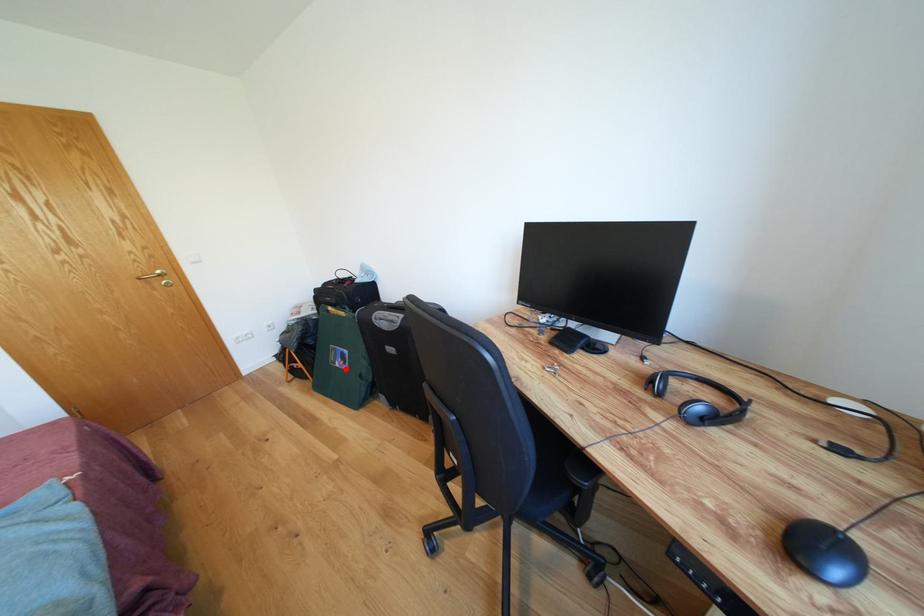
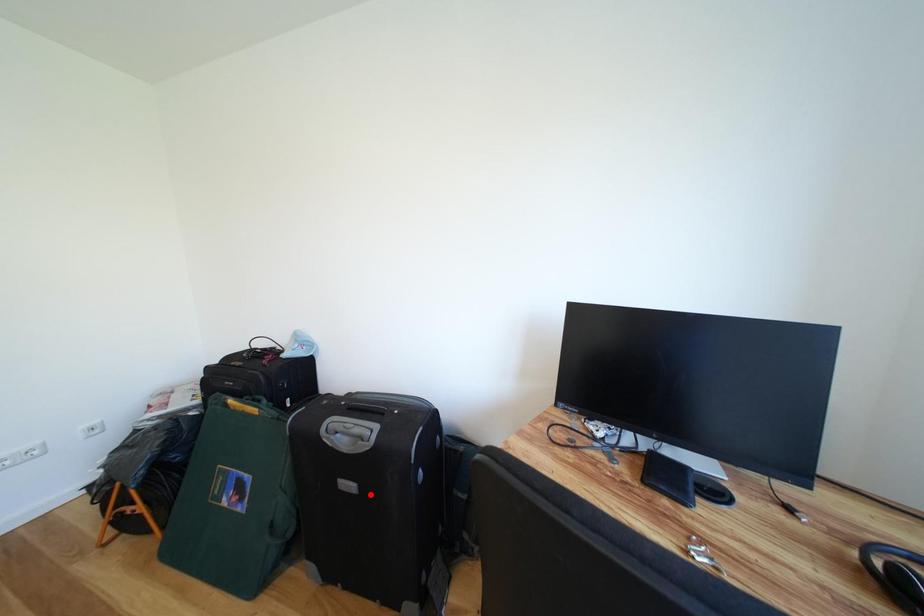
I am providing you with two images of the same scene from different viewpoints. A red point is marked on the first image and another point is marked on the second image. Is the red point in image1 aligned with the point shown in image2?

No